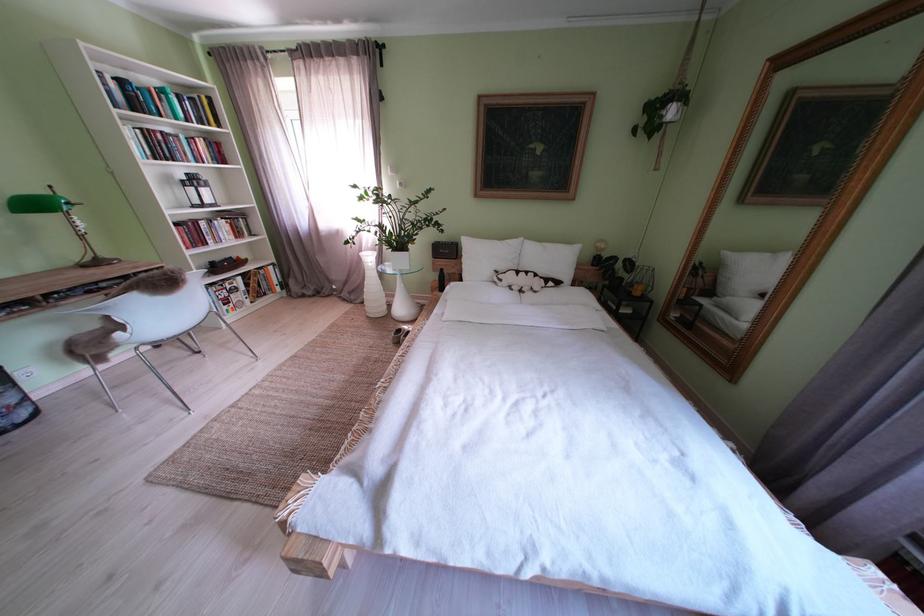
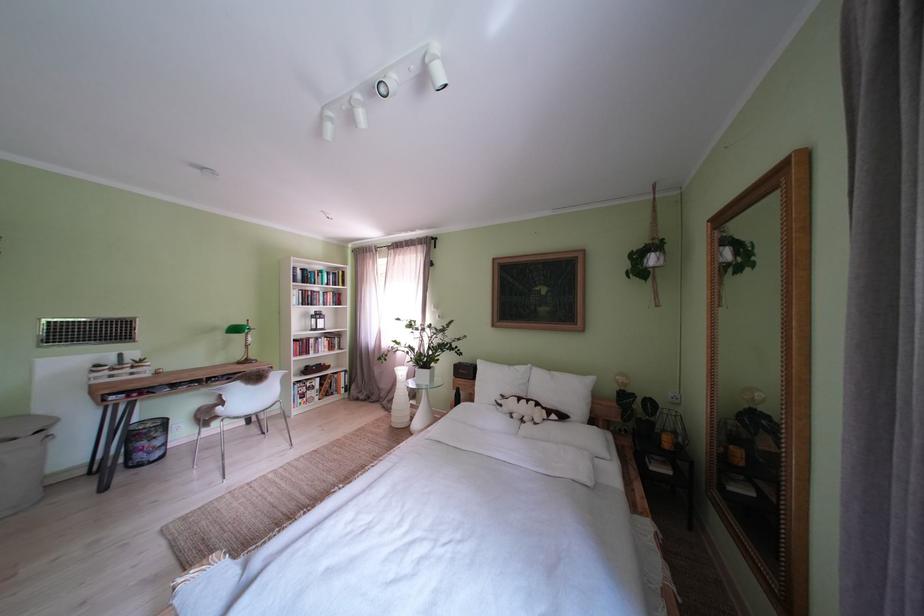
Where in the second image is the point corresponding to point (363, 302) from the first image?

(400, 411)